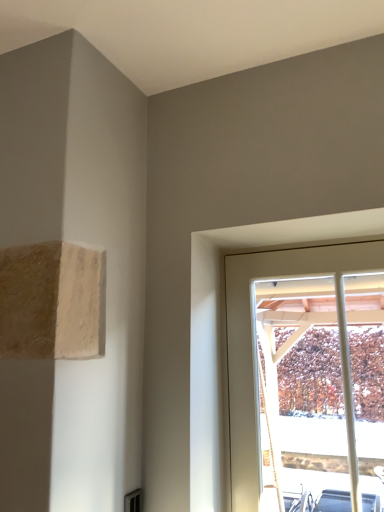
This screenshot has width=384, height=512. What do you see at coordinates (255, 345) in the screenshot? I see `white wood window at upper right` at bounding box center [255, 345].

At what (x,y) coordinates should I click in order to perform the action: click on white wood window at upper right. Please return your answer as a coordinate pair (x, y). The height and width of the screenshot is (512, 384). Looking at the image, I should click on (255, 345).

This screenshot has width=384, height=512. Identify the location of white wood window at upper right. (255, 345).